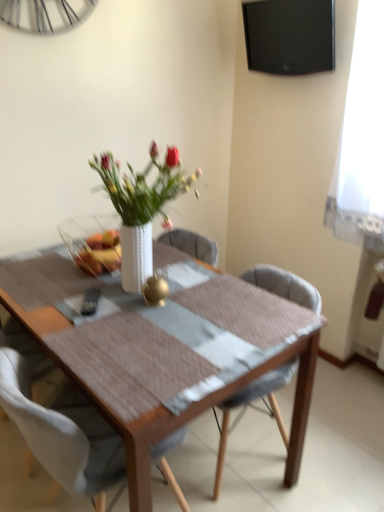
Question: From a real-world perspective, is wooden table at center above or below white fabric chair at center, marked as the first chair in a left-to-right arrangement?

Choices:
 (A) below
 (B) above

Answer: (A)

Question: From the image's perspective, is wooden table at center positioned above or below white fabric chair at center, marked as the first chair in a left-to-right arrangement?

Choices:
 (A) above
 (B) below

Answer: (A)

Question: Which is farther from the light gray fabric chair at center, the 2th chair from the left?

Choices:
 (A) translucent glass bowl at center
 (B) wooden table at center
 (C) white fabric chair at center, arranged as the second chair when viewed from the right
 (D) black glossy tv at upper right

Answer: (D)

Question: Estimate the real-world distances between objects in this image. Which object is closer to the wooden table at center?

Choices:
 (A) light gray fabric chair at center, the 2th chair from the left
 (B) translucent glass bowl at center
 (C) black glossy tv at upper right
 (D) white fabric chair at center, marked as the first chair in a left-to-right arrangement

Answer: (D)